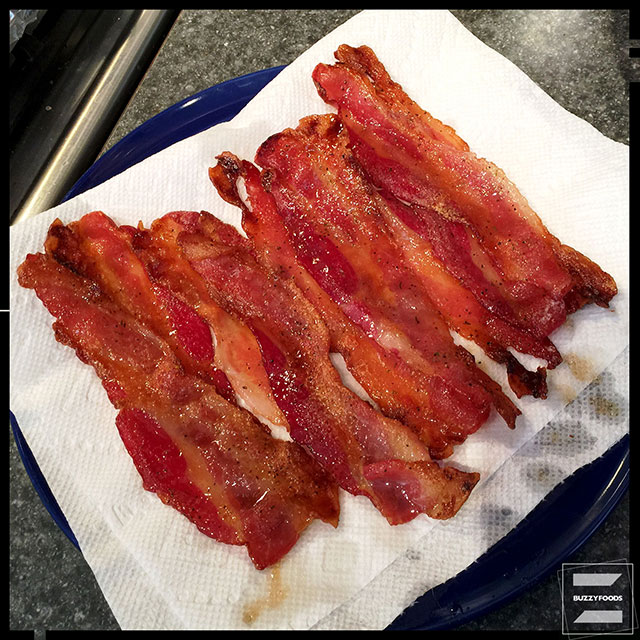
What are the coordinates of `counter top` in the screenshot? It's located at (265, 38).